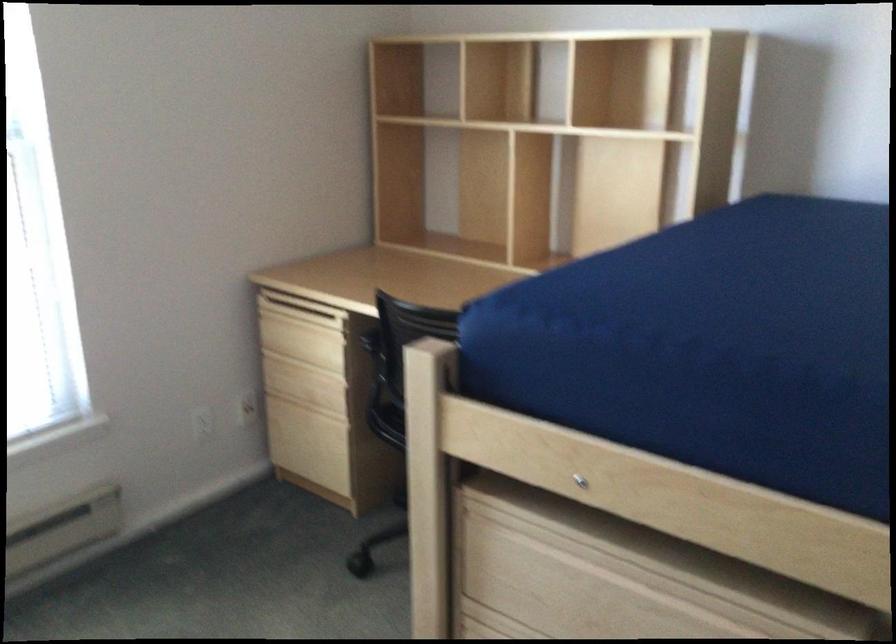
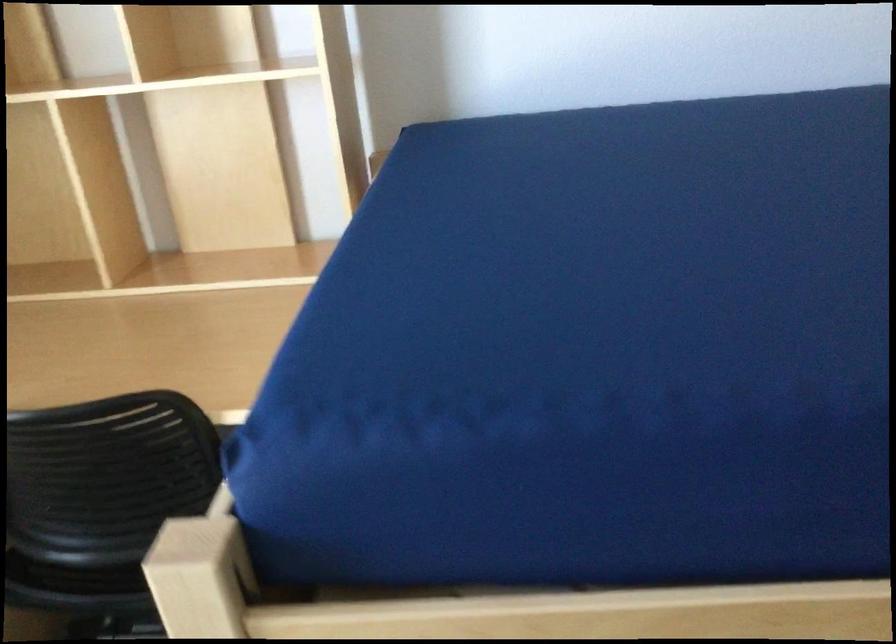
Question: How did the camera likely rotate?

Choices:
 (A) Left
 (B) Right
 (C) Up
 (D) Down

Answer: (B)